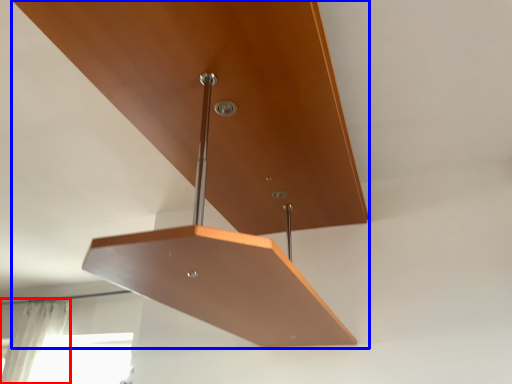
Question: Which of the following is the closest to the observer, curtain (highlighted by a red box) or furniture (highlighted by a blue box)?

Choices:
 (A) curtain
 (B) furniture

Answer: (B)